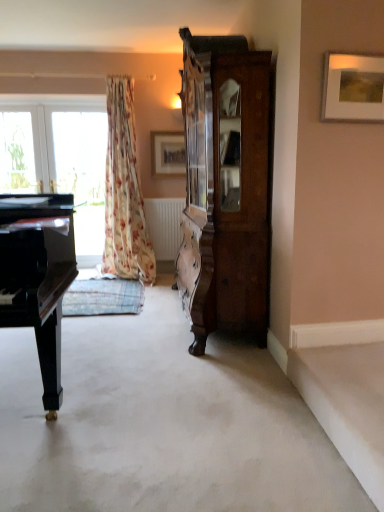
Locate an element on the screen. Image resolution: width=384 pixels, height=512 pixels. vacant space to the right of high-gloss black piano at left is located at coordinates (191, 408).